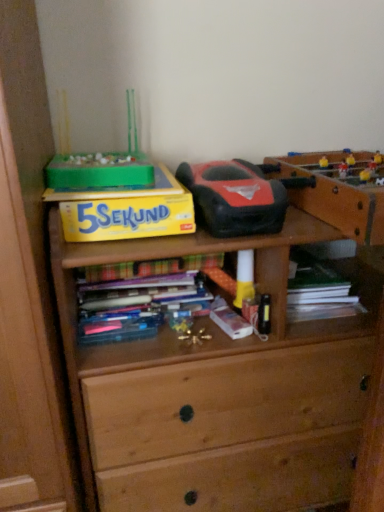
Question: Can you confirm if metallic gold toy at center, which is counted as the first toy, starting from the bottom, is smaller than rubberized black and red toy car at center, placed as the 1th toy when sorted from top to bottom?

Choices:
 (A) no
 (B) yes

Answer: (B)

Question: From a real-world perspective, is metallic gold toy at center, which is counted as the first toy, starting from the bottom, beneath rubberized black and red toy car at center, which is the 2th toy in bottom-to-top order?

Choices:
 (A) yes
 (B) no

Answer: (A)

Question: Can you confirm if metallic gold toy at center, which is counted as the first toy, starting from the bottom, is positioned to the right of rubberized black and red toy car at center, which is the 2th toy in bottom-to-top order?

Choices:
 (A) yes
 (B) no

Answer: (B)

Question: Is metallic gold toy at center, which is counted as the first toy, starting from the bottom, not close to rubberized black and red toy car at center, placed as the 1th toy when sorted from top to bottom?

Choices:
 (A) yes
 (B) no

Answer: (B)

Question: Is rubberized black and red toy car at center, placed as the 1th toy when sorted from top to bottom, surrounded by metallic gold toy at center, which is counted as the first toy, starting from the bottom?

Choices:
 (A) no
 (B) yes

Answer: (A)

Question: Considering the positions of point (210, 202) and point (382, 209), is point (210, 202) closer or farther from the camera than point (382, 209)?

Choices:
 (A) closer
 (B) farther

Answer: (B)

Question: Would you say rubberized black and red toy car at center, which is the 2th toy in bottom-to-top order, is to the left or to the right of wooden table at upper right in the picture?

Choices:
 (A) left
 (B) right

Answer: (A)

Question: Do you think rubberized black and red toy car at center, which is the 2th toy in bottom-to-top order, is within wooden table at upper right, or outside of it?

Choices:
 (A) inside
 (B) outside

Answer: (B)

Question: From a real-world perspective, is rubberized black and red toy car at center, placed as the 1th toy when sorted from top to bottom, positioned above or below wooden table at upper right?

Choices:
 (A) below
 (B) above

Answer: (B)

Question: From a real-world perspective, is wooden table at upper right positioned above or below rubberized black and red toy car at center, placed as the 1th toy when sorted from top to bottom?

Choices:
 (A) above
 (B) below

Answer: (B)

Question: Looking at the image, does wooden table at upper right seem bigger or smaller compared to rubberized black and red toy car at center, placed as the 1th toy when sorted from top to bottom?

Choices:
 (A) small
 (B) big

Answer: (B)

Question: Which is correct: wooden table at upper right is inside rubberized black and red toy car at center, placed as the 1th toy when sorted from top to bottom, or outside of it?

Choices:
 (A) inside
 (B) outside

Answer: (B)

Question: Is wooden table at upper right in front of or behind rubberized black and red toy car at center, which is the 2th toy in bottom-to-top order, in the image?

Choices:
 (A) behind
 (B) front

Answer: (B)

Question: Which is correct: wooden table at upper right is inside hardcover book at center, or outside of it?

Choices:
 (A) outside
 (B) inside

Answer: (A)

Question: Does point (306, 168) appear closer or farther from the camera than point (195, 257)?

Choices:
 (A) closer
 (B) farther

Answer: (B)